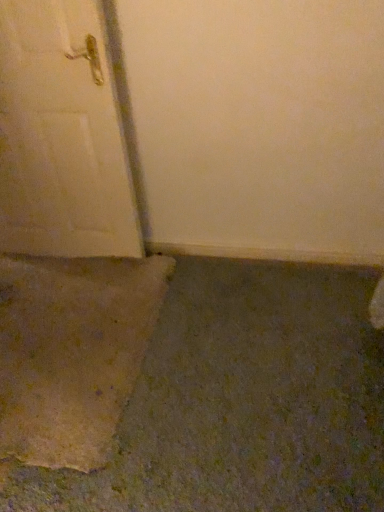
Describe the element at coordinates (61, 136) in the screenshot. I see `matte white door at left` at that location.

I want to click on matte white door at left, so click(x=61, y=136).

Identify the location of matte white door at left. (61, 136).